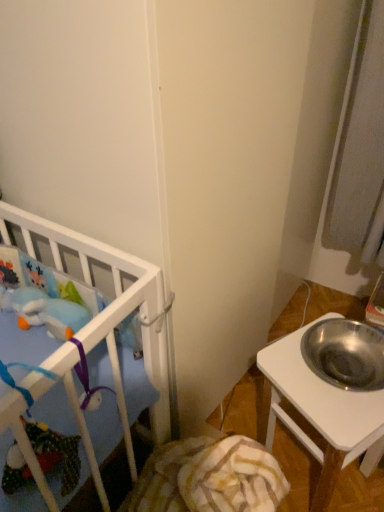
At what (x,y) coordinates should I click in order to perform the action: click on empty space that is ontop of metallic silver bowl at right (from a real-world perspective). Please return your answer as a coordinate pair (x, y). Looking at the image, I should click on (335, 371).